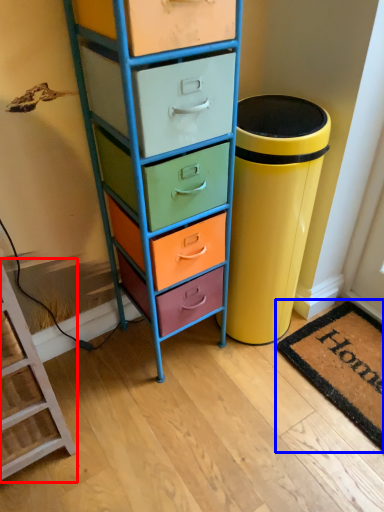
Question: Which object appears closest to the camera in this image, furniture (highlighted by a red box) or mat (highlighted by a blue box)?

Choices:
 (A) furniture
 (B) mat

Answer: (A)